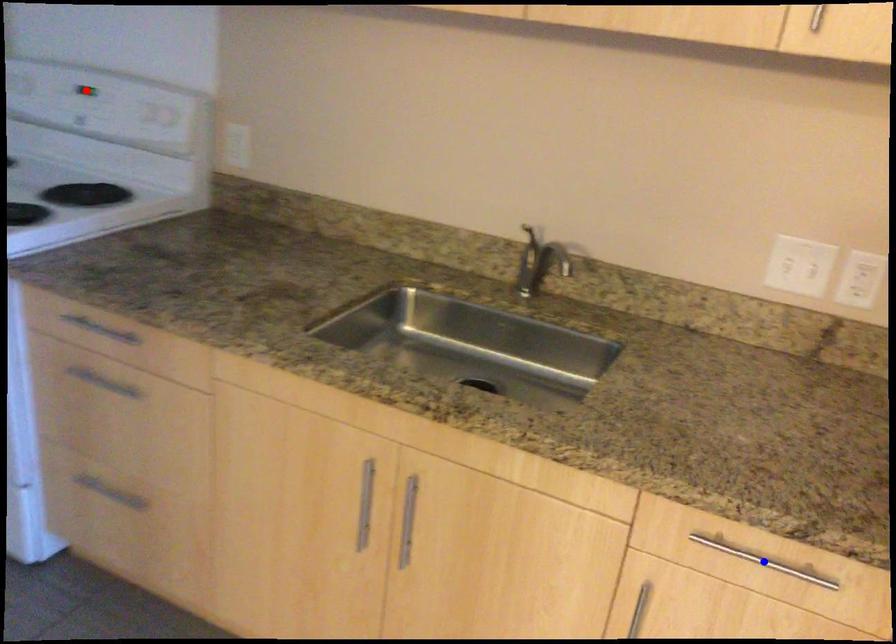
Question: Two points are marked on the image. Which point is closer to the camera?

Choices:
 (A) Blue point is closer.
 (B) Red point is closer.

Answer: (A)